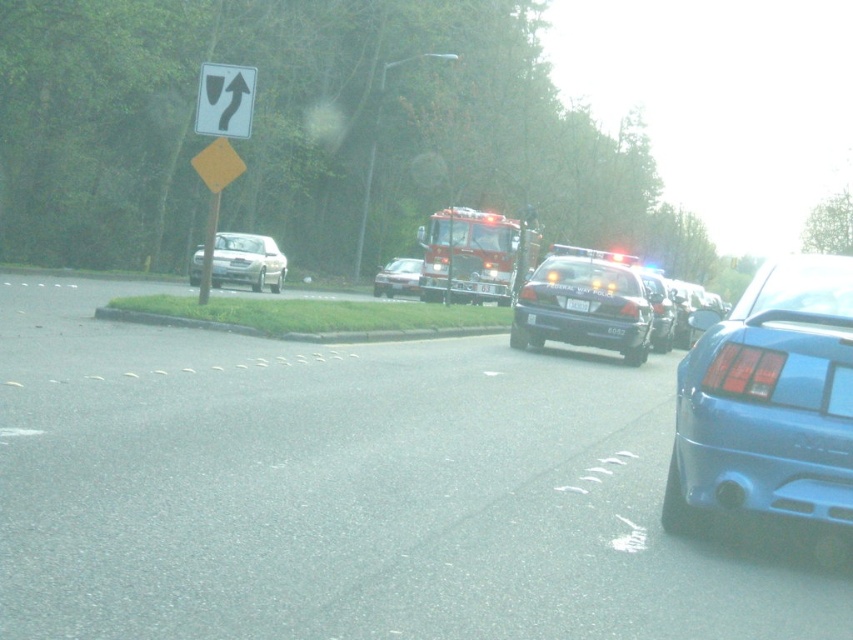
You are a pedestrian standing at the edge of the road. You see a silver metallic sedan at center and a black plastic license plate at center. Can you safely walk between them without getting too close? Explain why or why not.

The silver metallic sedan at center and the black plastic license plate at center are 80.97 feet apart from each other. Since the distance is quite large, you can safely walk between them without getting too close.

You are a pedestrian standing at the crosswalk and need to cross the street. You see a blue matte car at lower right and a silver metallic sedan at center. Which vehicle is shorter in height?

The blue matte car at lower right is shorter than the silver metallic sedan at center.

You are a delivery driver who needs to park your 1.8 meter wide truck between the silver metallic sedan at center and the black plastic license plate at center. Can you safely park there without touching either object?

The silver metallic sedan at center might be wider than black plastic license plate at center, so there might not be enough space for the 1.8 meter wide truck between them. It is not safe to park there.